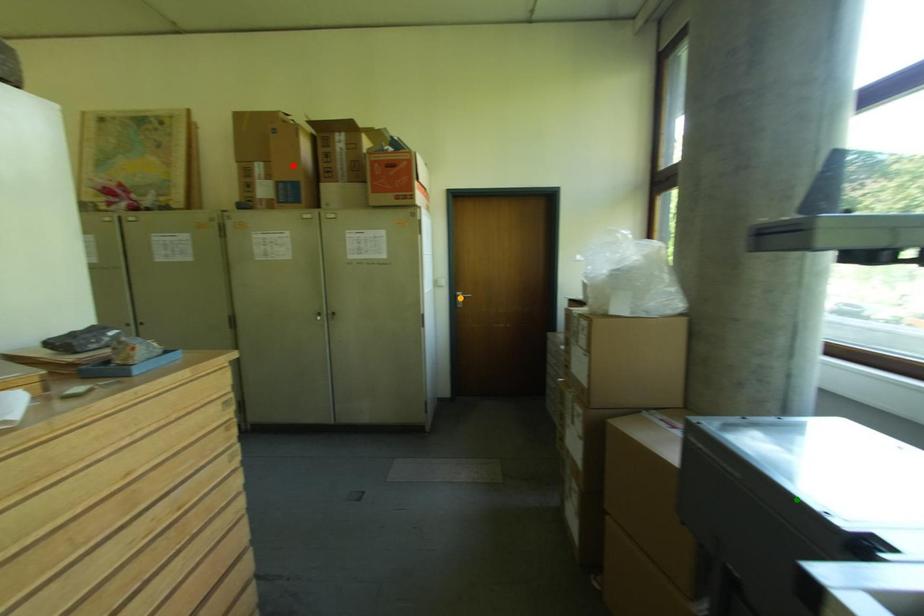
Order these from nearest to farthest:
green point, red point, orange point

orange point
red point
green point